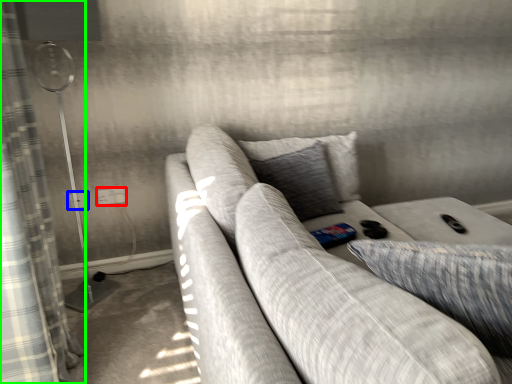
Question: Which is farther away from electric outlet (highlighted by a red box)? electric outlet (highlighted by a blue box) or curtain (highlighted by a green box)?

Choices:
 (A) electric outlet
 (B) curtain

Answer: (B)